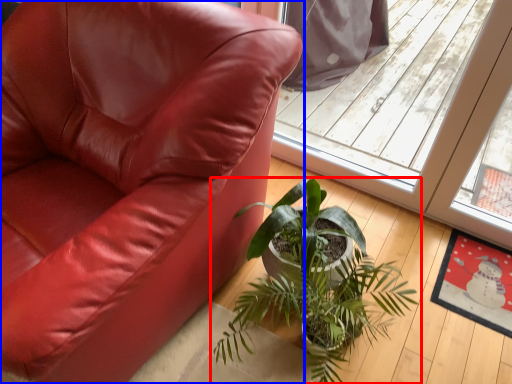
Question: Which point is further to the camera, houseplant (highlighted by a red box) or chair (highlighted by a blue box)?

Choices:
 (A) houseplant
 (B) chair

Answer: (A)